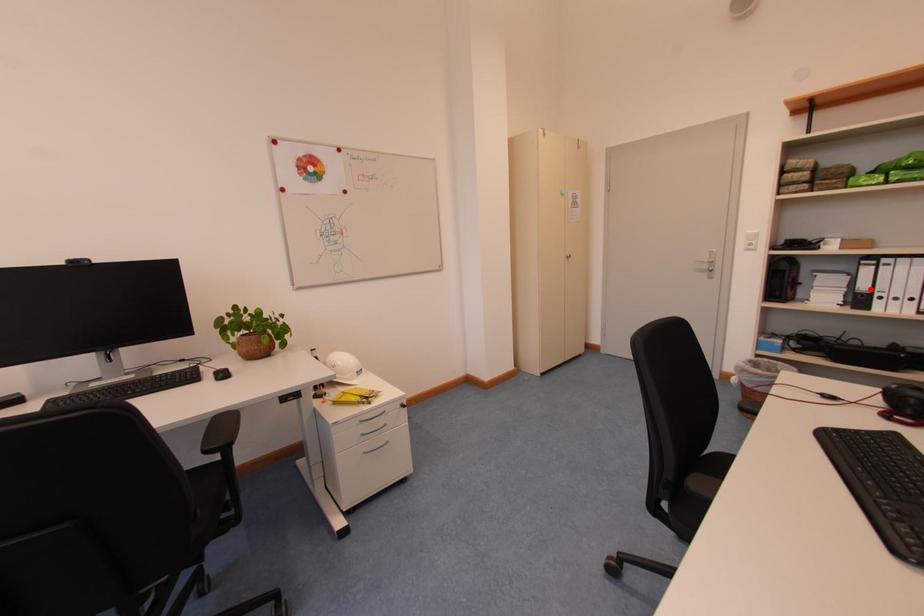
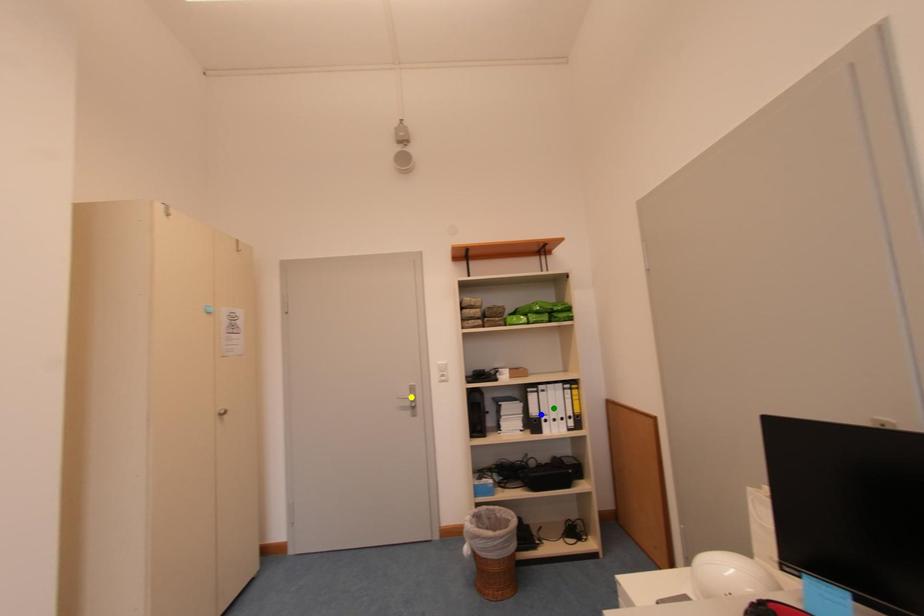
Question: I am providing you with two images of the same scene from different viewpoints. A red point is marked on the first image. You are given multiple points on the second image. In image 2, which mark is for the same physical point as the one in image 1?

Choices:
 (A) yellow point
 (B) blue point
 (C) green point

Answer: (B)